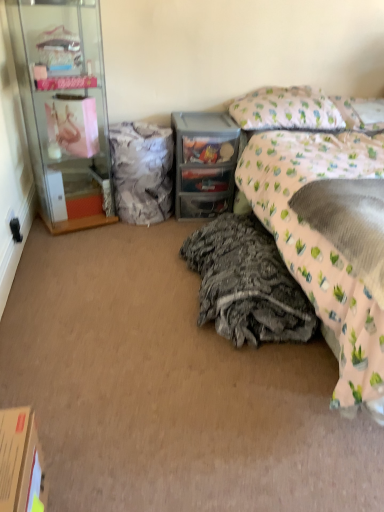
Question: Is translucent plastic drawer at center bigger than floral fabric bed at right?

Choices:
 (A) yes
 (B) no

Answer: (B)

Question: Is translucent plastic drawer at center turned away from floral fabric bed at right?

Choices:
 (A) no
 (B) yes

Answer: (A)

Question: Is the depth of translucent plastic drawer at center less than that of floral fabric bed at right?

Choices:
 (A) yes
 (B) no

Answer: (B)

Question: Is translucent plastic drawer at center oriented towards floral fabric bed at right?

Choices:
 (A) yes
 (B) no

Answer: (B)

Question: Is floral fabric bed at right surrounded by translucent plastic drawer at center?

Choices:
 (A) no
 (B) yes

Answer: (A)

Question: From a real-world perspective, is translucent plastic drawer at center located beneath floral fabric bed at right?

Choices:
 (A) yes
 (B) no

Answer: (A)

Question: Does cardboard box at lower left have a smaller size compared to clear glass cabinet at left?

Choices:
 (A) no
 (B) yes

Answer: (B)

Question: Can you confirm if cardboard box at lower left is shorter than clear glass cabinet at left?

Choices:
 (A) yes
 (B) no

Answer: (A)

Question: From a real-world perspective, is cardboard box at lower left located beneath clear glass cabinet at left?

Choices:
 (A) no
 (B) yes

Answer: (B)

Question: Is the depth of cardboard box at lower left less than that of clear glass cabinet at left?

Choices:
 (A) no
 (B) yes

Answer: (B)

Question: Does cardboard box at lower left have a larger size compared to clear glass cabinet at left?

Choices:
 (A) no
 (B) yes

Answer: (A)

Question: Does cardboard box at lower left have a lesser width compared to clear glass cabinet at left?

Choices:
 (A) no
 (B) yes

Answer: (B)

Question: Does translucent plastic drawer at center have a larger size compared to textured gray blanket at lower center, which ranks as the second material in top-to-bottom order?

Choices:
 (A) yes
 (B) no

Answer: (B)